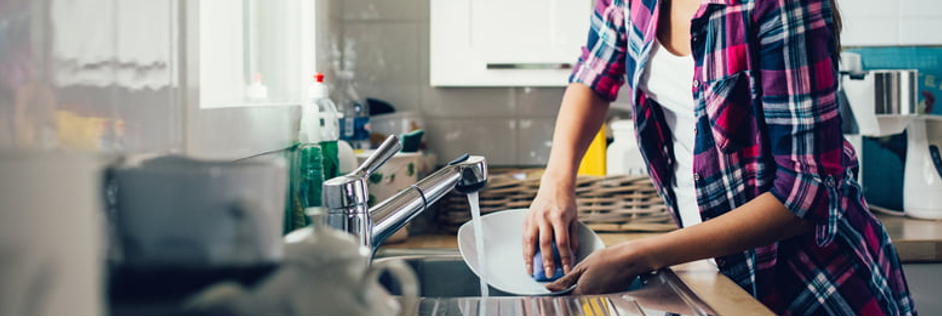
I want to click on kitchen bench, so click(x=715, y=288).